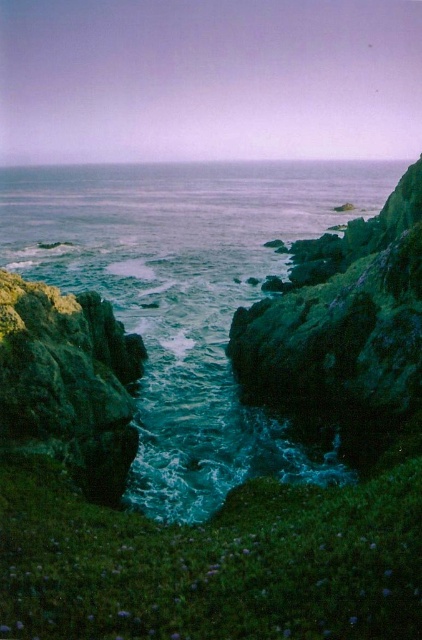
You are a photographer planning to capture the reflection of the green rough rock at center in the teal glossy water at center. Based on the scene, will the reflection be clear?

The teal glossy water at center is positioned over green rough rock at center, so the reflection of the green rough rock at center in the teal glossy water at center will be clear because the water is smooth and glossy, allowing for a mirror effect.

You are a drone operator tasked with capturing aerial footage of the coastal scene. The teal glossy water at center and the green rough rock at center are your primary subjects. Your drone has a maximum flight range of 60 meters. Can your drone safely capture footage of both subjects without needing to recharge or return to base?

The distance between the teal glossy water at center and the green rough rock at center is 60.01 meters, which exceeds the drone operator s 60 meter range. Therefore, the drone cannot safely capture footage of both subjects without needing to recharge or return to base.